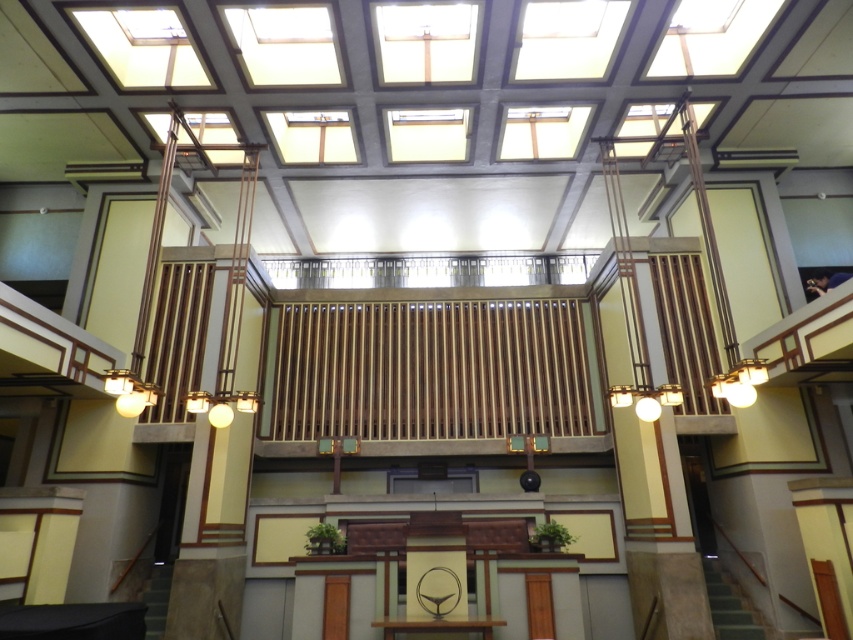
Which is below, green carpeted stairs at lower right or dark gray concrete stairs at lower left?

dark gray concrete stairs at lower left is below.

Is point (718, 602) farther from viewer compared to point (160, 566)?

That is False.

You are a GUI agent. You are given a task and a screenshot of the screen. Output one action in this format:
    pyautogui.click(x=<x>, y=<y>)
    Task: Click on the green carpeted stairs at lower right
    
    Given the screenshot: What is the action you would take?
    pyautogui.click(x=730, y=605)